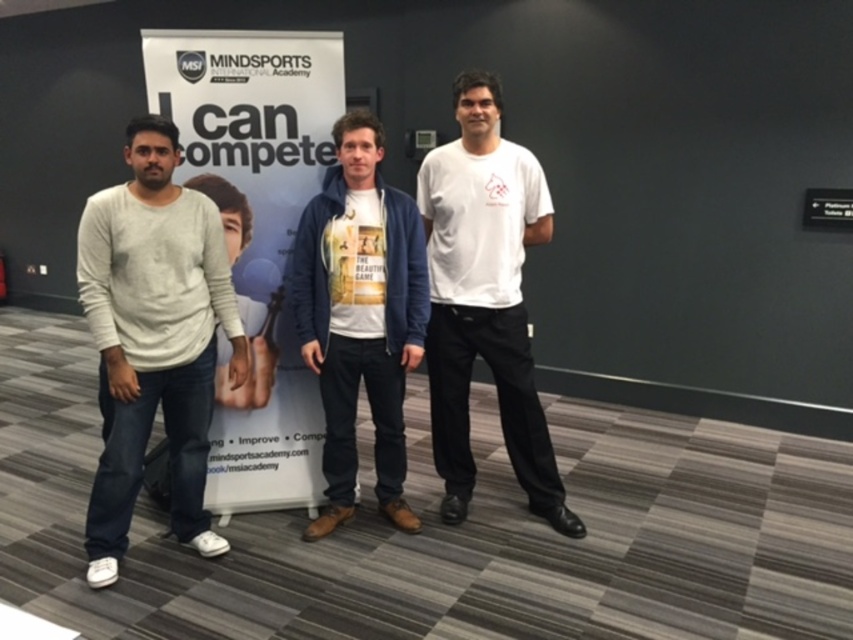
From the picture: Can you confirm if white matte t-shirt at center is taller than white cotton t-shirt at center?

Indeed, white matte t-shirt at center has a greater height compared to white cotton t-shirt at center.

Does white matte t-shirt at center have a lesser height compared to white cotton t-shirt at center?

No.

At what (x,y) coordinates should I click in order to perform the action: click on white matte t-shirt at center. Please return your answer as a coordinate pair (x, y). This screenshot has height=640, width=853. Looking at the image, I should click on [x=485, y=300].

Does white paperboard at center appear on the right side of white matte t-shirt at center?

No, white paperboard at center is not to the right of white matte t-shirt at center.

Which of these two, white paperboard at center or white matte t-shirt at center, stands shorter?

white matte t-shirt at center is shorter.

This screenshot has width=853, height=640. Find the location of `white paperboard at center`. white paperboard at center is located at coordinates (257, 234).

Can you confirm if light gray sweater at left is positioned above white matte t-shirt at center?

No.

Can you confirm if light gray sweater at left is bigger than white matte t-shirt at center?

Actually, light gray sweater at left might be smaller than white matte t-shirt at center.

This screenshot has width=853, height=640. In order to click on light gray sweater at left in this screenshot , I will do `click(154, 339)`.

Locate an element on the screen. This screenshot has height=640, width=853. light gray sweater at left is located at coordinates (154, 339).